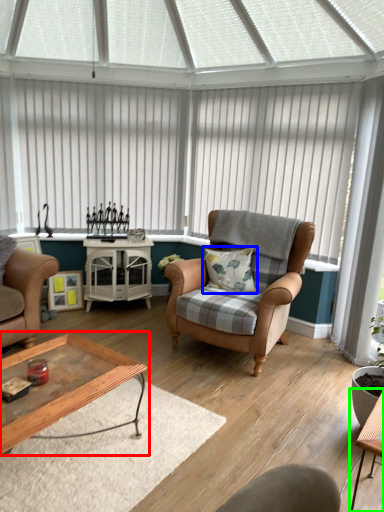
Question: Which object is positioned farthest from coffee table (highlighted by a red box)? Select from pillow (highlighted by a blue box) and table (highlighted by a green box).

Choices:
 (A) pillow
 (B) table

Answer: (A)